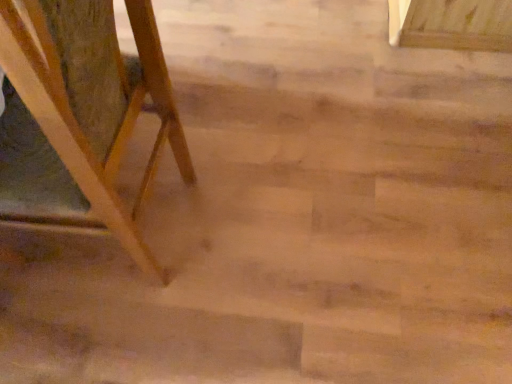
Describe the element at coordinates (81, 117) in the screenshot. The width and height of the screenshot is (512, 384). I see `wooden easel at left` at that location.

The width and height of the screenshot is (512, 384). In order to click on wooden easel at left in this screenshot , I will do `click(81, 117)`.

The height and width of the screenshot is (384, 512). Find the location of `wooden easel at left`. wooden easel at left is located at coordinates (81, 117).